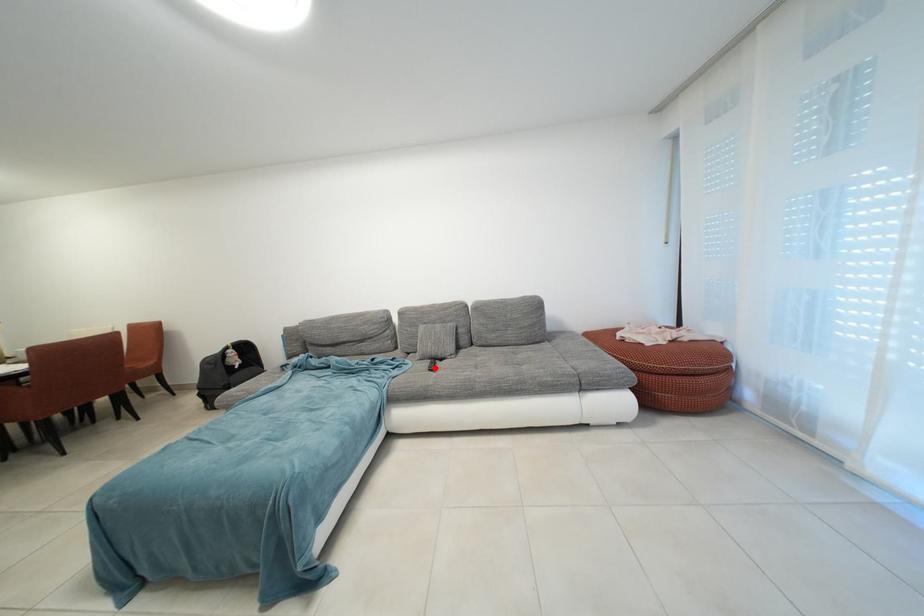
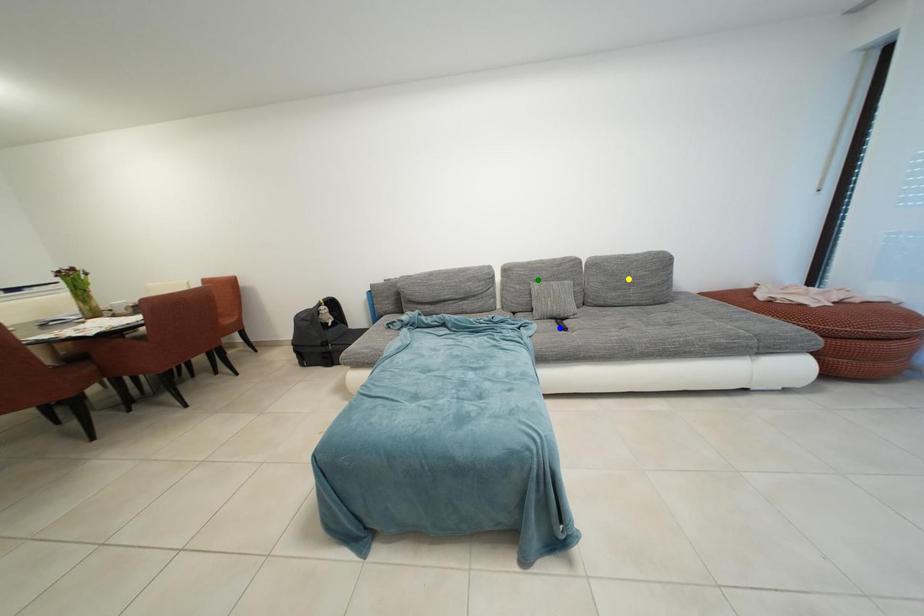
Question: I am providing you with two images of the same scene from different viewpoints. A red point is marked on the first image. You are given multiple points on the second image. Which point in image 2 is actually the same real-world point as the red point in image 1?

Choices:
 (A) green point
 (B) yellow point
 (C) blue point

Answer: (C)